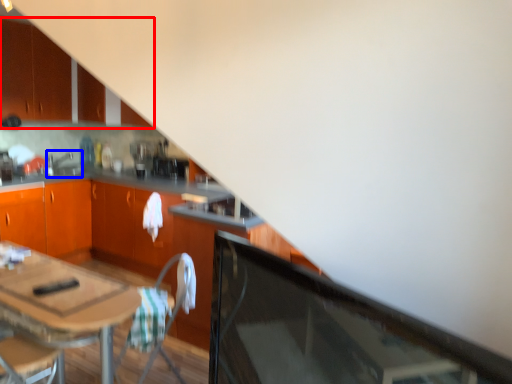
Question: Which object appears closest to the camera in this image, cabinetry (highlighted by a red box) or sink (highlighted by a blue box)?

Choices:
 (A) cabinetry
 (B) sink

Answer: (A)